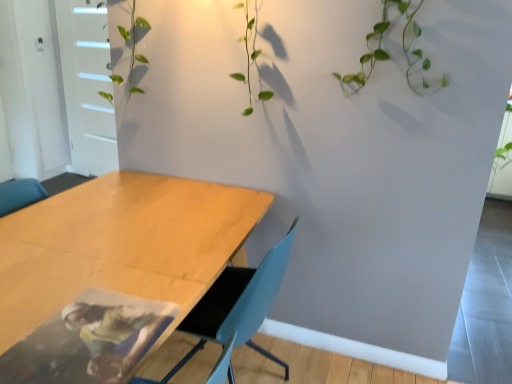
Question: Is wooden table at lower left bigger or smaller than light blue plastic chair at center?

Choices:
 (A) big
 (B) small

Answer: (A)

Question: Is wooden table at lower left spatially inside light blue plastic chair at center, or outside of it?

Choices:
 (A) outside
 (B) inside

Answer: (A)

Question: Based on their relative distances, which object is farther from the wooden table at lower left?

Choices:
 (A) light blue plastic chair at center
 (B) white matte door at upper left

Answer: (B)

Question: Estimate the real-world distances between objects in this image. Which object is farther from the wooden table at lower left?

Choices:
 (A) light blue plastic chair at center
 (B) white matte door at upper left

Answer: (B)